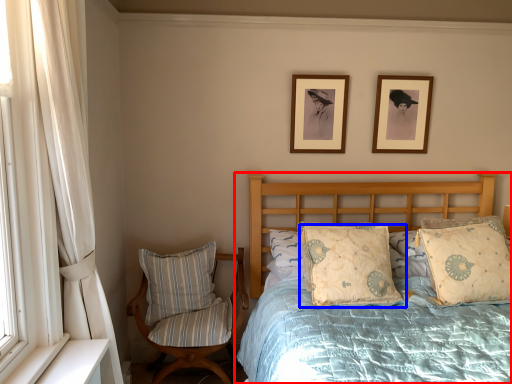
Question: Which of the following is the closest to the observer, bed (highlighted by a red box) or pillow (highlighted by a blue box)?

Choices:
 (A) bed
 (B) pillow

Answer: (A)